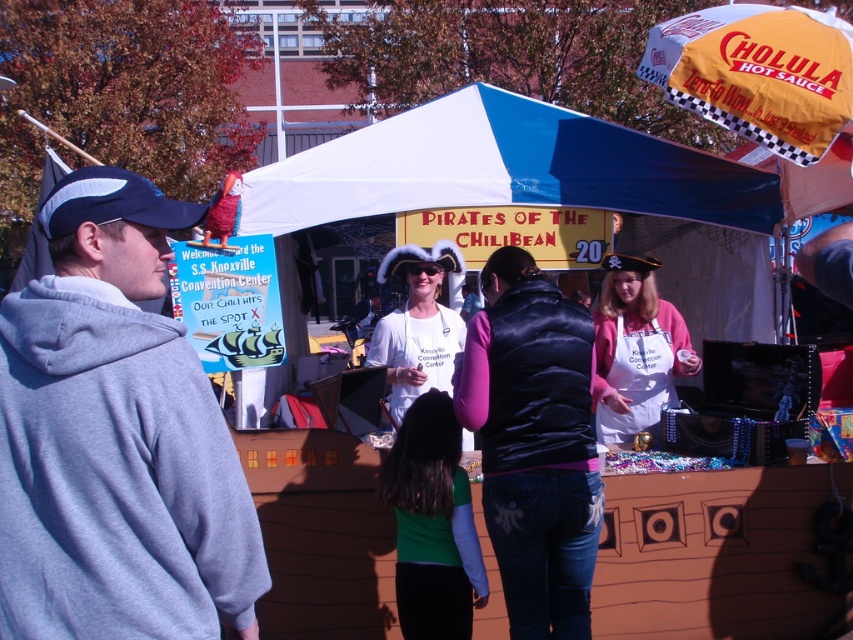
Question: Which of the following is the farthest from the observer?

Choices:
 (A) blue fabric canopy at upper center
 (B) gray fleece hoodie at left
 (C) black puffy vest at center
 (D) white fabric tent at center

Answer: (A)

Question: Does gray fleece hoodie at left lie behind yellow fabric umbrella at upper right?

Choices:
 (A) yes
 (B) no

Answer: (B)

Question: Estimate the real-world distances between objects in this image. Which object is closer to the yellow fabric umbrella at upper right?

Choices:
 (A) gray fleece hoodie at left
 (B) black puffy vest at center
 (C) pink fabric apron at center
 (D) white fabric tent at center

Answer: (D)

Question: Which object is positioned farthest from the yellow fabric umbrella at upper right?

Choices:
 (A) gray fleece hoodie at left
 (B) black puffy vest at center
 (C) white fabric tent at center
 (D) pink fabric apron at center

Answer: (A)

Question: Observing the image, what is the correct spatial positioning of gray fleece hoodie at left in reference to white fabric tent at center?

Choices:
 (A) right
 (B) left

Answer: (B)

Question: Can you confirm if blue fabric canopy at upper center is wider than pink fabric apron at center?

Choices:
 (A) yes
 (B) no

Answer: (A)